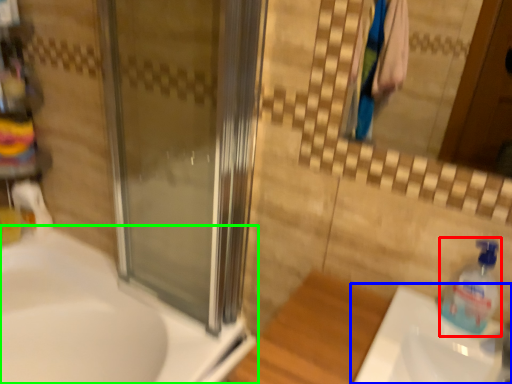
Question: Considering the real-world distances, which object is farthest from cleaning product (highlighted by a red box)? sink (highlighted by a blue box) or sink (highlighted by a green box)?

Choices:
 (A) sink
 (B) sink

Answer: (B)